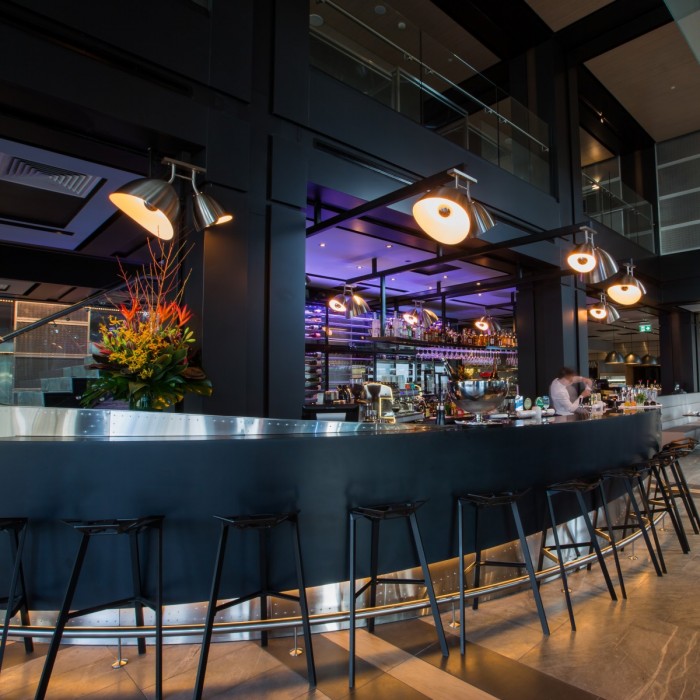
The height and width of the screenshot is (700, 700). In order to click on bar foot rest in this screenshot , I will do `click(491, 589)`.